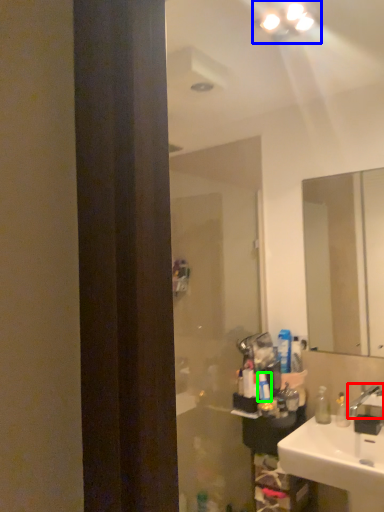
Question: Based on their relative distances, which object is nearer to tap (highlighted by a red box)? Choose from light fixture (highlighted by a blue box) and toiletry (highlighted by a green box).

Choices:
 (A) light fixture
 (B) toiletry

Answer: (B)